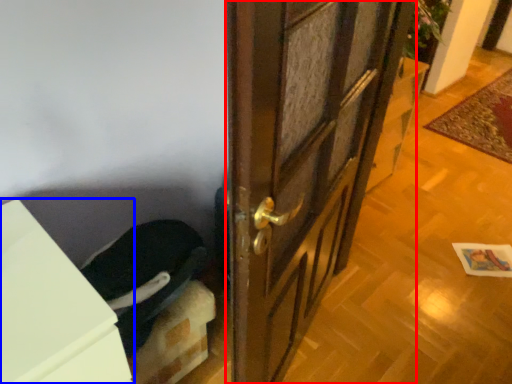
Question: Which of the following is the closest to the observer, door (highlighted by a red box) or cabinetry (highlighted by a blue box)?

Choices:
 (A) door
 (B) cabinetry

Answer: (B)